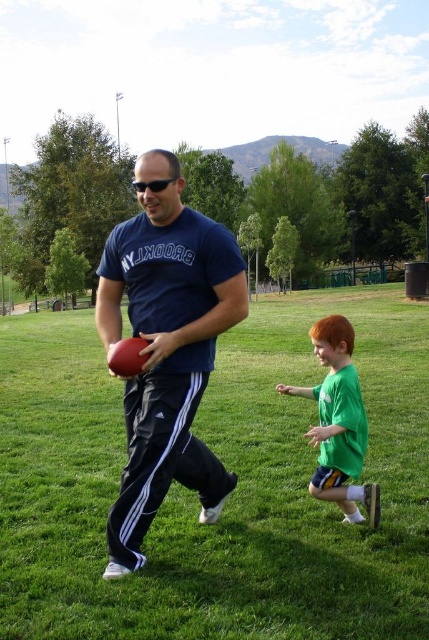
You are a drone operator trying to capture a photo of the two people in the scene. The green grass at center is your main focus, and you need to ensure the green matte shirt at right is also in the frame. Given that your camera has a maximum focus range of 15 feet, will you be able to capture both objects in focus at the same time?

The distance between the green grass at center and the green matte shirt at right is 17.15 feet, which exceeds the camera maximum focus range of 15 feet. Therefore, you cannot capture both objects in focus simultaneously.